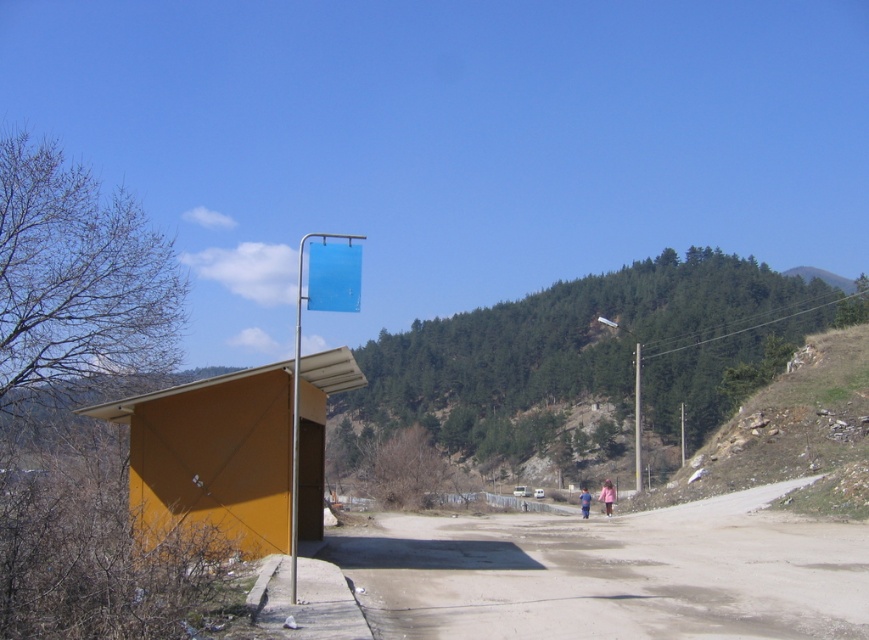
You are a pedestrian standing at the edge of the paved road. You see a blue plastic sign at center and a metallic pole at center. Which object is nearer to you?

The blue plastic sign at center is closer to the viewer than the metallic pole at center, so the blue plastic sign at center is nearer to you.

You are standing at the structure with a brownish orange facade and want to walk to the point marked at coordinates (611, 572). According to the scene description, what terrain will you primarily encounter along the way?

The point at (611, 572) is on dirt road at center, so you will primarily encounter dirt road terrain along the way.

You are a hiker walking along the road and see the blue plastic sign at center and the metallic pole at center. According to their positions, which one is closer to your left side?

The blue plastic sign at center is to the left of the metallic pole at center, so it is closer to your left side.